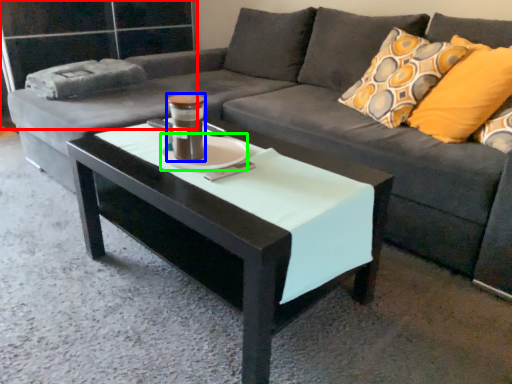
Question: Which object is the farthest from glass door (highlighted by a red box)? Choose among these: beverage (highlighted by a blue box) or saucer (highlighted by a green box).

Choices:
 (A) beverage
 (B) saucer

Answer: (A)